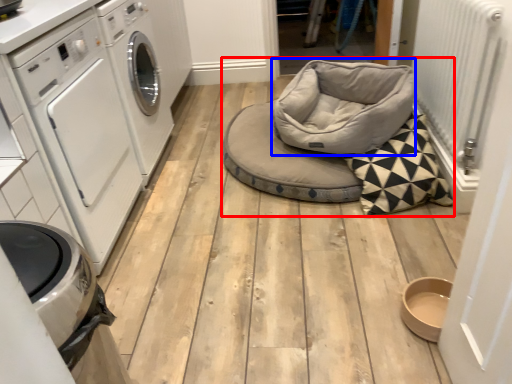
Question: Among these objects, which one is farthest to the camera, daybed (highlighted by a red box) or bean bag chair (highlighted by a blue box)?

Choices:
 (A) daybed
 (B) bean bag chair

Answer: (A)